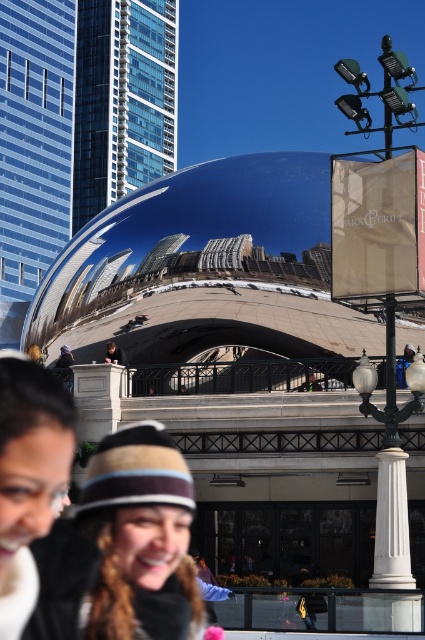
Question: Which of the following is the farthest from the observer?

Choices:
 (A) matte black hat at lower center
 (B) striped knit hat at center

Answer: (B)

Question: Does striped knit hat at center lie behind matte black hat at lower center?

Choices:
 (A) no
 (B) yes

Answer: (B)

Question: Which point is farther to the camera?

Choices:
 (A) (122, 472)
 (B) (45, 445)

Answer: (A)

Question: Is striped knit hat at center smaller than matte black hat at lower center?

Choices:
 (A) no
 (B) yes

Answer: (A)

Question: Where is striped knit hat at center located in relation to matte black hat at lower center in the image?

Choices:
 (A) right
 (B) left

Answer: (A)